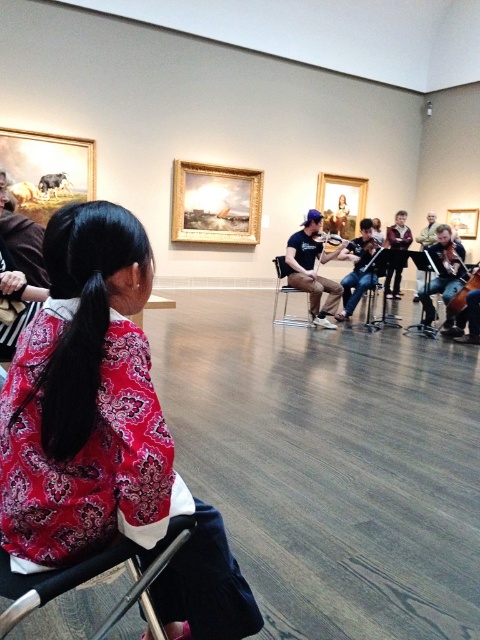
Does dark brown leather jacket at center have a lesser width compared to metallic silver chair at center?

Incorrect, dark brown leather jacket at center's width is not less than metallic silver chair at center's.

How distant is dark brown leather jacket at center from metallic silver chair at center?

dark brown leather jacket at center is 3.26 meters from metallic silver chair at center.

You are a GUI agent. You are given a task and a screenshot of the screen. Output one action in this format:
    pyautogui.click(x=<x>, y=<y>)
    Task: Click on the dark brown leather jacket at center
    Image resolution: width=480 pixels, height=640 pixels.
    Given the screenshot: What is the action you would take?
    pyautogui.click(x=398, y=232)

The image size is (480, 640). In order to click on dark brown leather jacket at center in this screenshot , I will do `click(398, 232)`.

Is shiny silver cello at center positioned in front of dark brown leather jacket at center?

Yes, shiny silver cello at center is in front of dark brown leather jacket at center.

Is point (421, 289) positioned behind point (397, 230)?

No, it is in front of (397, 230).

Does point (431, 288) come in front of point (385, 241)?

Yes, point (431, 288) is closer to viewer.

At what (x,y) coordinates should I click in order to perform the action: click on shiny silver cello at center. Please return your answer as a coordinate pair (x, y). The width and height of the screenshot is (480, 640). Looking at the image, I should click on (443, 272).

Is black plastic chair at center positioned in front of dark brown polished wood cello at right?

Result: No, black plastic chair at center is behind dark brown polished wood cello at right.

Is black plastic chair at center below dark brown polished wood cello at right?

Indeed, black plastic chair at center is positioned under dark brown polished wood cello at right.

At what (x,y) coordinates should I click in order to perform the action: click on black plastic chair at center. Please return your answer as a coordinate pair (x, y). This screenshot has height=640, width=480. Looking at the image, I should click on (423, 307).